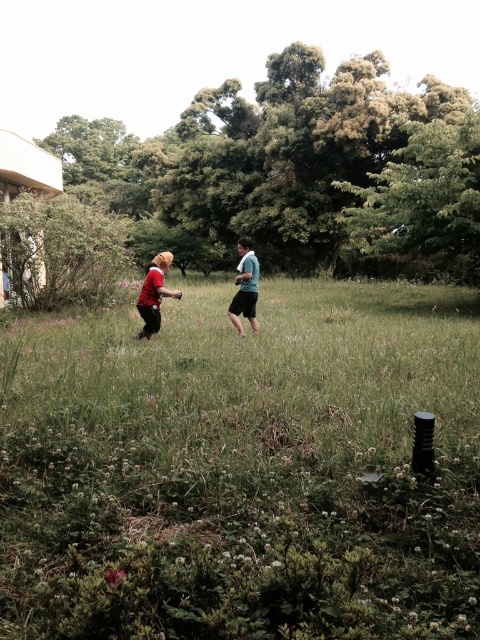
Does green grassy field at center have a greater width compared to matte red shirt at center?

Yes, green grassy field at center is wider than matte red shirt at center.

What do you see at coordinates (242, 468) in the screenshot? I see `green grassy field at center` at bounding box center [242, 468].

Does point (72, 436) lie behind point (164, 268)?

No.

Identify the location of green grassy field at center. (242, 468).

Between matte blue shirt at center and matte red shirt at center, which one has less height?

matte red shirt at center is shorter.

Which is behind, point (231, 307) or point (170, 260)?

The point (231, 307) is more distant.

The width and height of the screenshot is (480, 640). Identify the location of matte blue shirt at center. (244, 285).

Which of these two, green grassy field at center or matte blue shirt at center, stands taller?

Standing taller between the two is matte blue shirt at center.

This screenshot has width=480, height=640. I want to click on green grassy field at center, so click(242, 468).

At what (x,y) coordinates should I click in order to perform the action: click on green grassy field at center. Please return your answer as a coordinate pair (x, y). This screenshot has height=640, width=480. Looking at the image, I should click on (242, 468).